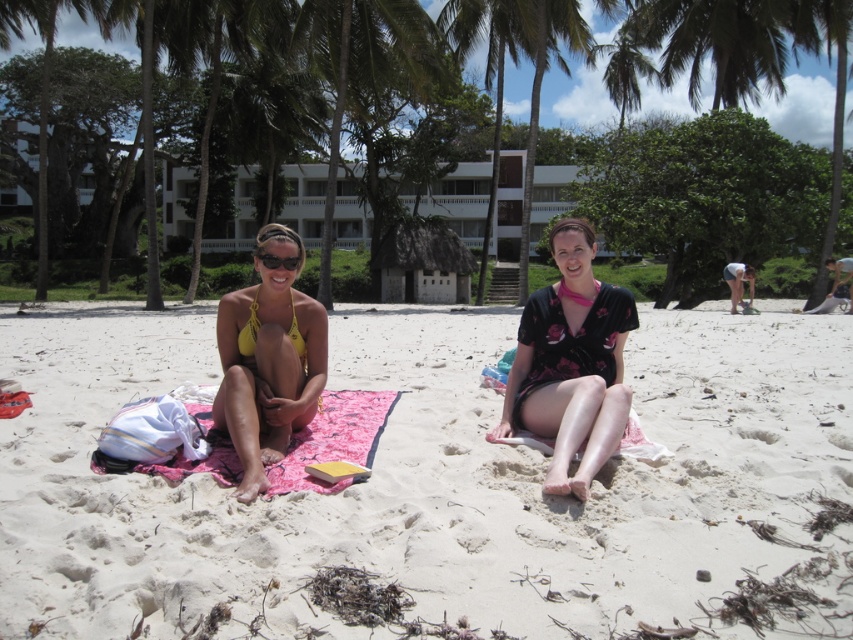
Question: Does white sandy beach at center appear on the left side of green leafy palm tree at upper left?

Choices:
 (A) no
 (B) yes

Answer: (A)

Question: Is yellow bikini at left above pink fabric blanket at center?

Choices:
 (A) no
 (B) yes

Answer: (B)

Question: Which of the following is the farthest from the observer?

Choices:
 (A) (270, 445)
 (B) (202, 460)
 (C) (45, 264)
 (D) (442, 586)

Answer: (C)

Question: Estimate the real-world distances between objects in this image. Which object is farther from the yellow bikini at left?

Choices:
 (A) black floral dress at center
 (B) green leafy palm tree at upper center

Answer: (B)

Question: Does pink fabric blanket at center come in front of green leafy palm tree at center?

Choices:
 (A) yes
 (B) no

Answer: (A)

Question: Which of the following is the closest to the observer?

Choices:
 (A) (239, 360)
 (B) (440, 19)
 (C) (82, 12)
 (D) (531, 173)

Answer: (A)